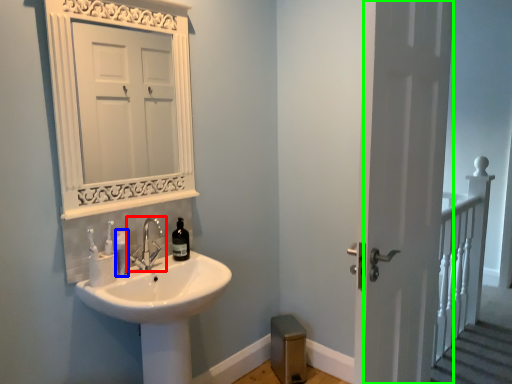
Question: Which is nearer to the tap (highlighted by a red box)? toiletry (highlighted by a blue box) or screen door (highlighted by a green box).

Choices:
 (A) toiletry
 (B) screen door

Answer: (A)